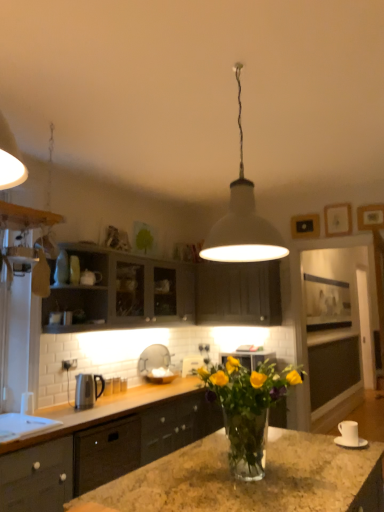
Question: From the image's perspective, is matte gray cabinets at upper left, placed as the third cabinetry when sorted from bottom to top, over matte dark gray cabinet at center, the second cabinetry positioned from the top?

Choices:
 (A) no
 (B) yes

Answer: (B)

Question: Are matte gray cabinets at upper left, placed as the third cabinetry when sorted from bottom to top, and matte dark gray cabinet at center, the second cabinetry positioned from the top, located far from each other?

Choices:
 (A) no
 (B) yes

Answer: (A)

Question: Does matte gray cabinets at upper left, positioned as the 1th cabinetry in top-to-bottom order, turn towards matte dark gray cabinet at center, the second cabinetry positioned from the top?

Choices:
 (A) no
 (B) yes

Answer: (B)

Question: Can you confirm if matte gray cabinets at upper left, placed as the third cabinetry when sorted from bottom to top, is positioned to the right of matte dark gray cabinet at center, the second cabinetry positioned from the top?

Choices:
 (A) no
 (B) yes

Answer: (A)

Question: Is matte gray cabinets at upper left, placed as the third cabinetry when sorted from bottom to top, next to matte dark gray cabinet at center, the second cabinetry positioned from the top, and touching it?

Choices:
 (A) yes
 (B) no

Answer: (B)

Question: Does matte gray cabinets at upper left, placed as the third cabinetry when sorted from bottom to top, come behind matte dark gray cabinet at center, the second cabinetry positioned from the top?

Choices:
 (A) yes
 (B) no

Answer: (B)

Question: From a real-world perspective, is satin black kettle at left, the 2th appliance viewed from the front, beneath white glossy sink at center?

Choices:
 (A) yes
 (B) no

Answer: (A)

Question: Is satin black kettle at left, the 1th appliance from the left, at the left side of white glossy sink at center?

Choices:
 (A) no
 (B) yes

Answer: (B)

Question: Is satin black kettle at left, placed as the 2th appliance when sorted from back to front, closer to the viewer compared to white glossy sink at center?

Choices:
 (A) yes
 (B) no

Answer: (A)

Question: From a real-world perspective, is satin black kettle at left, the 2th appliance viewed from the front, on white glossy sink at center?

Choices:
 (A) yes
 (B) no

Answer: (B)

Question: Does satin black kettle at left, the 1th appliance from the left, lie behind white glossy sink at center?

Choices:
 (A) no
 (B) yes

Answer: (A)

Question: From the image's perspective, is satin black kettle at left, placed as the 2th appliance when sorted from back to front, over white glossy sink at center?

Choices:
 (A) no
 (B) yes

Answer: (B)

Question: Is matte black cabinets at center, which is the first cabinetry from bottom to top, at the right side of white matte pendant light at center?

Choices:
 (A) no
 (B) yes

Answer: (A)